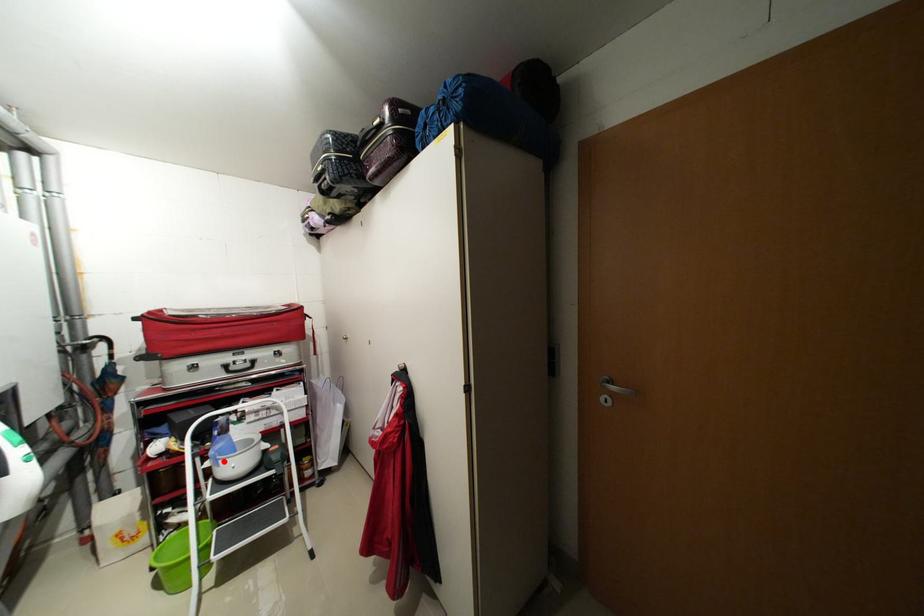
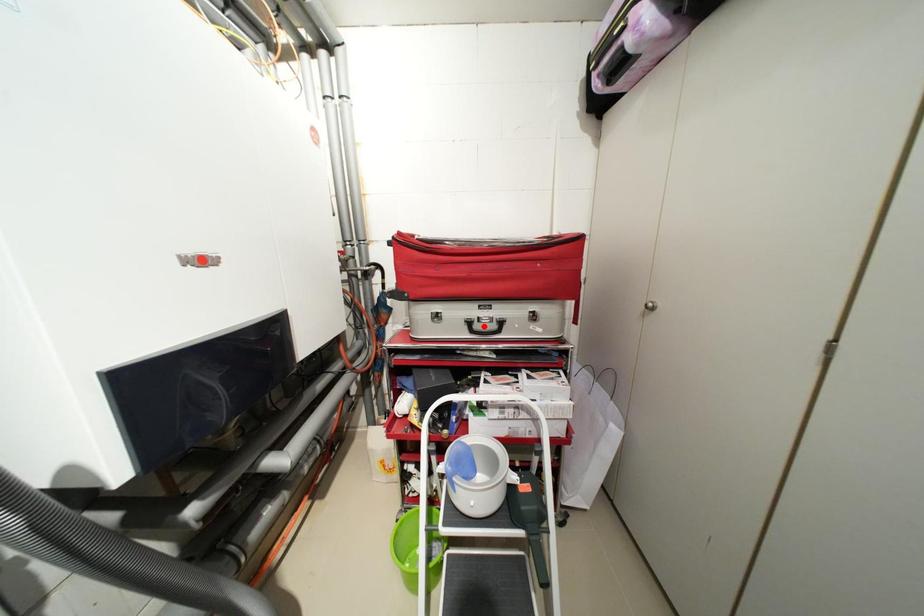
I am providing you with two images of the same scene from different viewpoints. A red point is marked on the first image and another point is marked on the second image. Is the red point in image1 aligned with the point shown in image2?

No